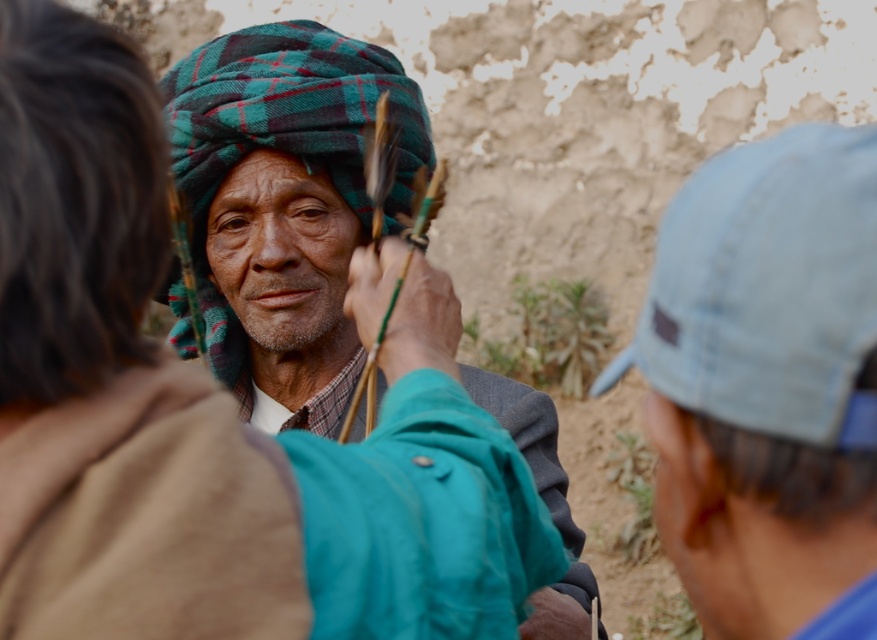
Is light blue fabric cap at right further to camera compared to green plaid turban at center?

No, light blue fabric cap at right is in front of green plaid turban at center.

Is point (722, 630) farther from camera compared to point (227, 381)?

No, (722, 630) is closer to viewer.

Between point (838, 628) and point (424, 134), which one is positioned in front?

Point (838, 628) is more forward.

You are a GUI agent. You are given a task and a screenshot of the screen. Output one action in this format:
    pyautogui.click(x=<x>, y=<y>)
    Task: Click on the light blue fabric cap at right
    The height and width of the screenshot is (640, 877).
    Given the screenshot: What is the action you would take?
    pyautogui.click(x=767, y=385)

Does point (786, 349) come closer to viewer compared to point (529, 394)?

Yes, it is.

Is light blue fabric cap at right taller than plaid wool turban at center?

No, light blue fabric cap at right is not taller than plaid wool turban at center.

Image resolution: width=877 pixels, height=640 pixels. Describe the element at coordinates (767, 385) in the screenshot. I see `light blue fabric cap at right` at that location.

I want to click on light blue fabric cap at right, so click(x=767, y=385).

Is plaid wool turban at center smaller than green plaid turban at center?

No.

What do you see at coordinates (284, 205) in the screenshot?
I see `plaid wool turban at center` at bounding box center [284, 205].

Find the location of a particular element. This screenshot has height=640, width=877. plaid wool turban at center is located at coordinates (284, 205).